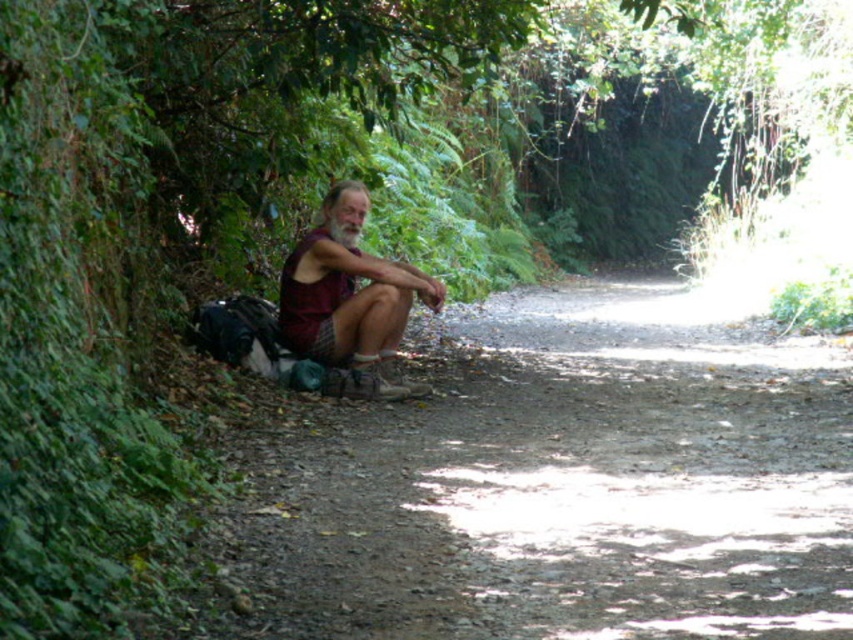
Question: Does dirt path at left have a greater width compared to maroon fabric shirt at center?

Choices:
 (A) yes
 (B) no

Answer: (A)

Question: Among these points, which one is farthest from the camera?

Choices:
 (A) (845, 388)
 (B) (374, 305)

Answer: (A)

Question: Which of the following is the farthest from the observer?

Choices:
 (A) maroon fabric shirt at center
 (B) dirt path at left

Answer: (A)

Question: Which point is closer to the camera?

Choices:
 (A) dirt path at left
 (B) maroon fabric shirt at center

Answer: (A)

Question: Is dirt path at left positioned at the back of maroon fabric shirt at center?

Choices:
 (A) yes
 (B) no

Answer: (B)

Question: Is dirt path at left positioned before maroon fabric shirt at center?

Choices:
 (A) yes
 (B) no

Answer: (A)